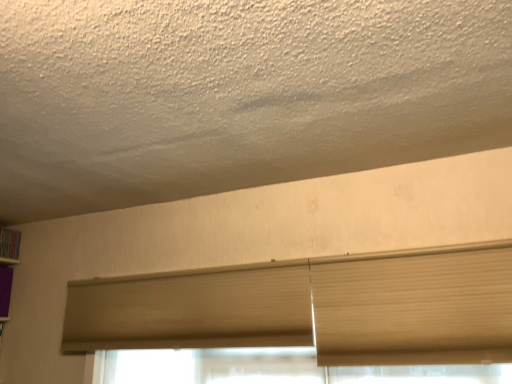
Identify the location of beige ribbed curtain at center. The width and height of the screenshot is (512, 384). (191, 309).

What do you see at coordinates (191, 309) in the screenshot?
I see `beige ribbed curtain at center` at bounding box center [191, 309].

In order to click on beige ribbed curtain at center in this screenshot , I will do `click(191, 309)`.